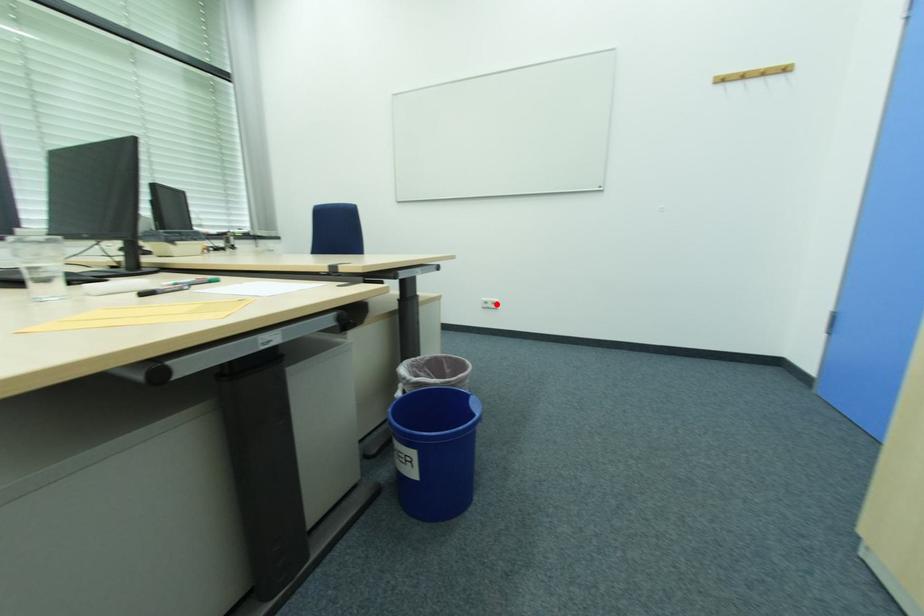
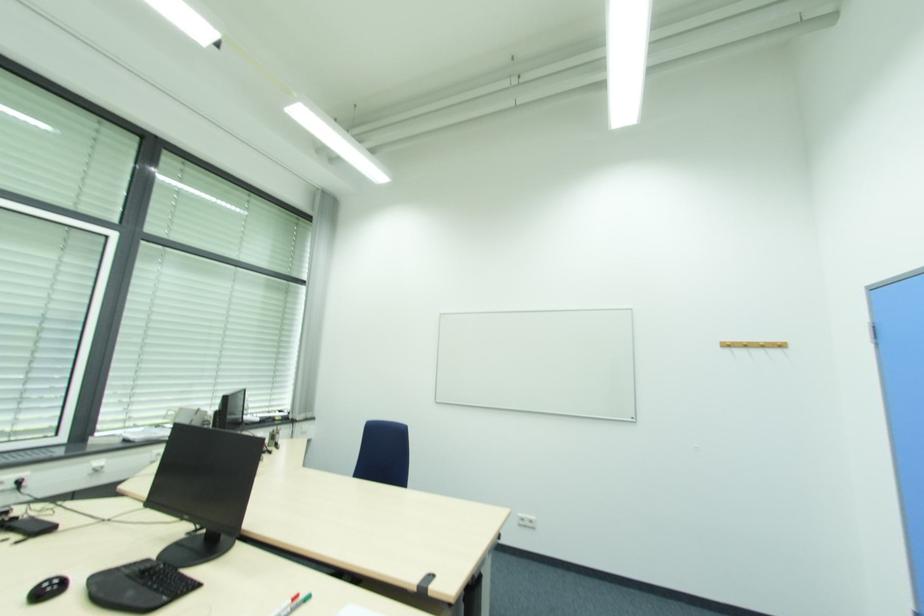
Question: I am providing you with two images of the same scene from different viewpoints. Image1 has a red point marked. In image2, the corresponding 3D location appears at what relative position? Reply with the corresponding letter.

Choices:
 (A) Closer
 (B) Farther

Answer: (B)